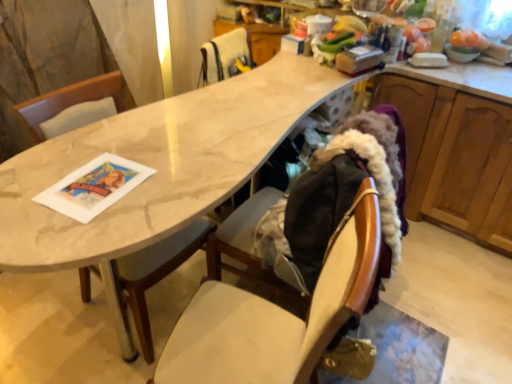
Question: Considering the positions of wooden cabinet at right and wooden chair at center, arranged as the first chair when ordered from the bottom, in the image, is wooden cabinet at right taller or shorter than wooden chair at center, arranged as the first chair when ordered from the bottom,?

Choices:
 (A) short
 (B) tall

Answer: (A)

Question: Is wooden cabinet at right in front of or behind wooden chair at center, which appears as the second chair when viewed from the top, in the image?

Choices:
 (A) behind
 (B) front

Answer: (A)

Question: Which object is the farthest from the wooden cabinet at right?

Choices:
 (A) wooden chair at center, arranged as the first chair when ordered from the bottom
 (B) white fur at upper center, the 1th chair from the back

Answer: (A)

Question: Which is nearer to the wooden cabinet at right?

Choices:
 (A) wooden chair at center, the 1th chair in the front-to-back sequence
 (B) white fur at upper center, which is counted as the 1th chair, starting from the top

Answer: (B)